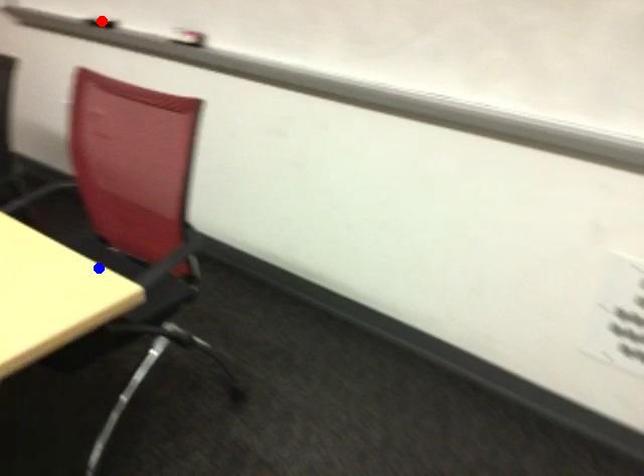
Question: In the image, two points are highlighted. Which point is nearer to the camera? Reply with the corresponding letter.

Choices:
 (A) blue point
 (B) red point

Answer: (A)